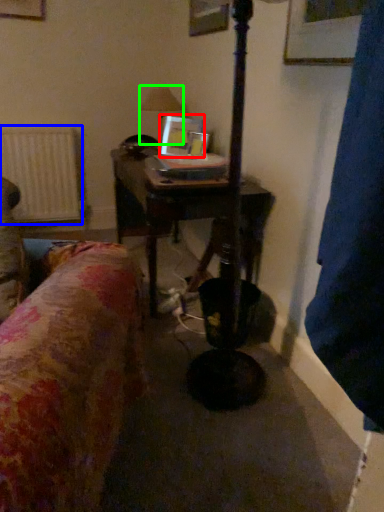
Question: Estimate the real-world distances between objects in this image. Which object is closer to picture frame (highlighted by a red box), radiator (highlighted by a blue box) or table lamp (highlighted by a green box)?

Choices:
 (A) radiator
 (B) table lamp

Answer: (B)